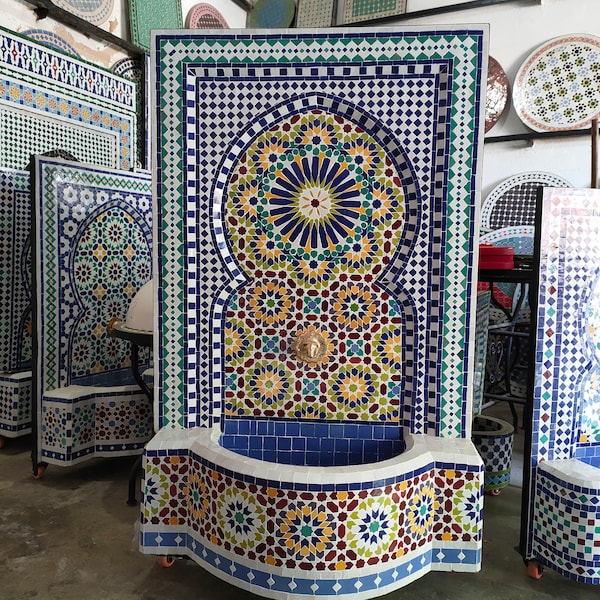
The image size is (600, 600). Identify the location of round geometric design plates on upper shelf. (571, 87), (86, 5), (207, 19).